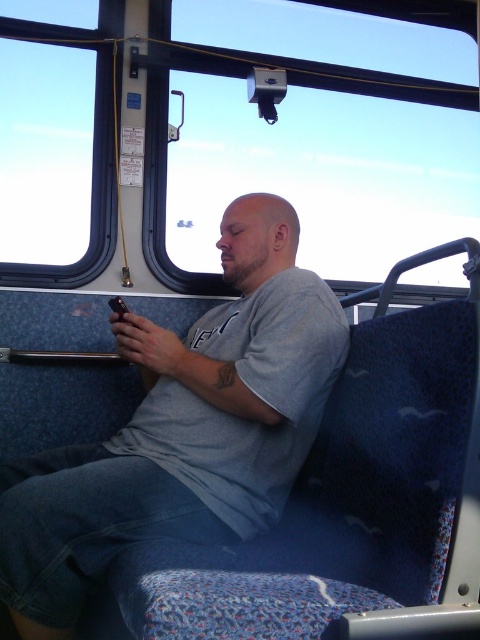
You are a passenger on a bus and want to check the view outside through the transparent glass window at center and the transparent glass window at upper left. Which window should you choose if you want to see more of the sky?

The transparent glass window at center is taller than the transparent glass window at upper left, so you should choose the transparent glass window at center to see more of the sky.

You are a passenger on a bus and want to know which of the two points, point (400, 189) or point (36, 67), is closer to you. Based on the scene description, can you determine this?

Point (400, 189) is further to the viewer than point (36, 67), so the closer point is point (36, 67).

You are a passenger sitting in the blue upholstered seat with a patterned fabric. You want to look outside through the transparent glass window at center and the transparent glass window at upper left. Which window is closer to you?

The transparent glass window at upper left is behind the transparent glass window at center, so the transparent glass window at center is closer to you.